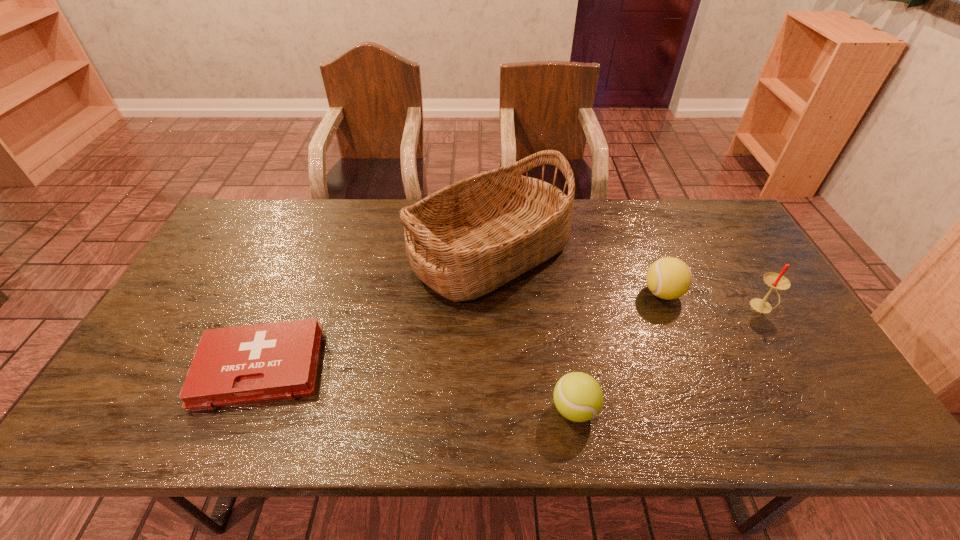
What are the coordinates of `vacant space in between the right tennis ball and the tallest object` in the screenshot? It's located at (576, 273).

Where is `vacant area between the farther tennis ball and the basket`? The height and width of the screenshot is (540, 960). vacant area between the farther tennis ball and the basket is located at coordinates (576, 273).

Identify the location of unoccupied position between the tallest object and the leftmost object. tap(375, 310).

You are a GUI agent. You are given a task and a screenshot of the screen. Output one action in this format:
    pyautogui.click(x=<x>, y=<y>)
    Task: Click on the vacant space that's between the nearer tennis ball and the right tennis ball
    The width and height of the screenshot is (960, 540).
    Given the screenshot: What is the action you would take?
    pyautogui.click(x=618, y=351)

The image size is (960, 540). I want to click on object that is the closest to the basket, so click(x=248, y=364).

Point out which object is positioned as the third nearest to the leftmost object. Please provide its 2D coordinates. Your answer should be formatted as a tuple, i.e. [(x, y)], where the tuple contains the x and y coordinates of a point satisfying the conditions above.

[(669, 278)]

This screenshot has width=960, height=540. I want to click on free location that satisfies the following two spatial constraints: 1. on the front side of the shortest object; 2. on the right side of the nearer tennis ball, so click(x=244, y=409).

Locate an element on the screen. The width and height of the screenshot is (960, 540). vacant space that satisfies the following two spatial constraints: 1. on the back side of the tallest object; 2. on the left side of the shortest object is located at coordinates (308, 253).

Where is `free spot that satisfies the following two spatial constraints: 1. on the back side of the fourth object from left to right; 2. on the right side of the left tennis ball`? free spot that satisfies the following two spatial constraints: 1. on the back side of the fourth object from left to right; 2. on the right side of the left tennis ball is located at coordinates (556, 293).

Find the location of `free space that satisfies the following two spatial constraints: 1. on the back side of the candle; 2. on the right side of the leftmost object`. free space that satisfies the following two spatial constraints: 1. on the back side of the candle; 2. on the right side of the leftmost object is located at coordinates (285, 308).